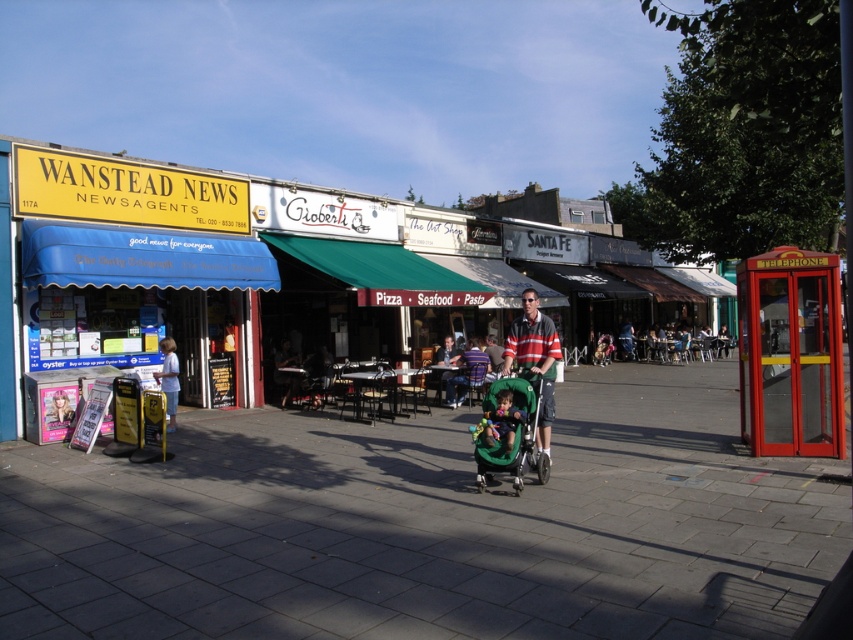
Does smooth concrete pavement at lower left appear on the right side of blonde hair at center?

Indeed, smooth concrete pavement at lower left is positioned on the right side of blonde hair at center.

In the scene shown: How distant is smooth concrete pavement at lower left from blonde hair at center?

smooth concrete pavement at lower left is 9.27 feet from blonde hair at center.

Is point (438, 547) positioned in front of point (62, 387)?

Yes, point (438, 547) is in front of point (62, 387).

I want to click on smooth concrete pavement at lower left, so click(x=428, y=525).

Between blonde hair at center and light blue shirt at center, which one appears on the left side from the viewer's perspective?

Positioned to the left is blonde hair at center.

In the scene shown: Does blonde hair at center have a lesser height compared to light blue shirt at center?

Yes, blonde hair at center is shorter than light blue shirt at center.

Is point (54, 412) less distant than point (171, 360)?

That is True.

Locate an element on the screen. This screenshot has height=640, width=853. blonde hair at center is located at coordinates (57, 406).

Does light blue shirt at center have a lesser height compared to smooth black jacket at center?

Incorrect, light blue shirt at center's height does not fall short of smooth black jacket at center's.

This screenshot has width=853, height=640. Identify the location of light blue shirt at center. (169, 380).